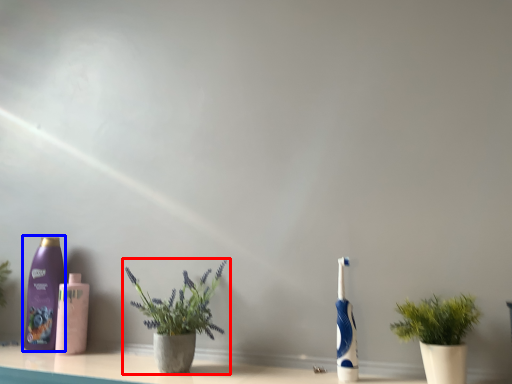
Question: Which object appears farthest to the camera in this image, houseplant (highlighted by a red box) or bottle (highlighted by a blue box)?

Choices:
 (A) houseplant
 (B) bottle

Answer: (B)